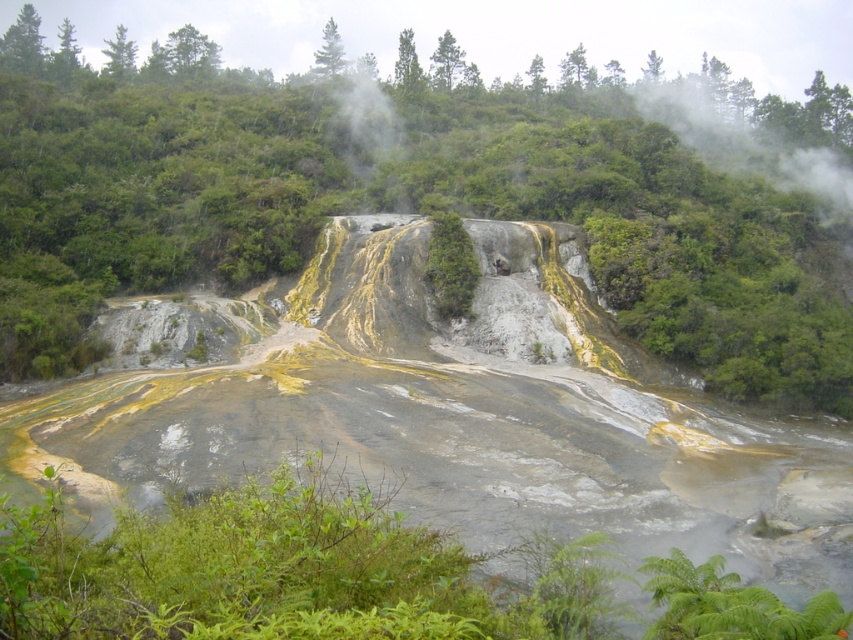
Can you confirm if green leafy shrubs at lower center is positioned to the left of green leafy shrub at center?

Indeed, green leafy shrubs at lower center is positioned on the left side of green leafy shrub at center.

Can you confirm if green leafy shrubs at lower center is shorter than green leafy shrub at center?

Indeed, green leafy shrubs at lower center has a lesser height compared to green leafy shrub at center.

Who is more forward, (186, 545) or (445, 228)?

Point (186, 545)

This screenshot has height=640, width=853. I want to click on green leafy shrubs at lower center, so click(x=283, y=573).

Is point (337, 205) positioned in front of point (827, 504)?

No, (337, 205) is further to viewer.

Is green leafy vegetation at center further to the viewer compared to yellowish sedimentary rock at center?

Yes, it is behind yellowish sedimentary rock at center.

Who is more forward, (0, 237) or (570, 333)?

Positioned in front is point (570, 333).

This screenshot has width=853, height=640. In order to click on green leafy vegetation at center in this screenshot , I will do `click(386, 200)`.

Between yellowish sedimentary rock at center and green leafy shrubs at lower center, which one appears on the right side from the viewer's perspective?

Positioned to the right is yellowish sedimentary rock at center.

Between point (59, 403) and point (653, 634), which one is positioned behind?

The point (59, 403) is more distant.

What do you see at coordinates (453, 410) in the screenshot? The image size is (853, 640). I see `yellowish sedimentary rock at center` at bounding box center [453, 410].

This screenshot has height=640, width=853. What are the coordinates of `yellowish sedimentary rock at center` in the screenshot? It's located at (453, 410).